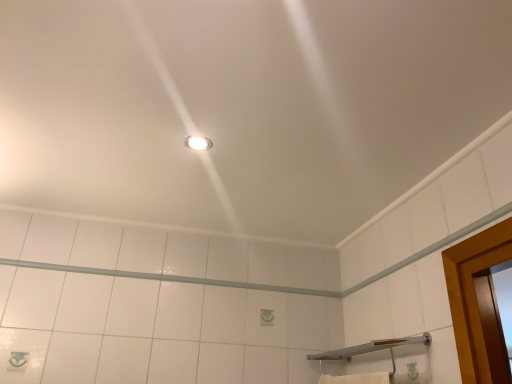
Where is `matte white light fixture at center`? This screenshot has height=384, width=512. matte white light fixture at center is located at coordinates (198, 143).

What do you see at coordinates (198, 143) in the screenshot? The image size is (512, 384). I see `matte white light fixture at center` at bounding box center [198, 143].

What is the approximate width of matte white light fixture at center?

matte white light fixture at center is 3.79 inches wide.

You are a GUI agent. You are given a task and a screenshot of the screen. Output one action in this format:
    pyautogui.click(x=<x>, y=<y>)
    Task: Click on the silver metallic shower at lower right
    The height and width of the screenshot is (384, 512).
    Given the screenshot: What is the action you would take?
    pyautogui.click(x=371, y=347)

Describe the element at coordinates (371, 347) in the screenshot. I see `silver metallic shower at lower right` at that location.

Where is `matte white light fixture at center`? The width and height of the screenshot is (512, 384). matte white light fixture at center is located at coordinates (198, 143).

Is silver metallic shower at lower right to the left of matte white light fixture at center from the viewer's perspective?

No, silver metallic shower at lower right is not to the left of matte white light fixture at center.

Is silver metallic shower at lower right in front of matte white light fixture at center?

Yes, silver metallic shower at lower right is in front of matte white light fixture at center.

Is point (341, 349) farther from viewer compared to point (202, 144)?

Yes.

From the image's perspective, relative to matte white light fixture at center, is silver metallic shower at lower right above or below?

From the image's perspective, silver metallic shower at lower right appears below matte white light fixture at center.

From a real-world perspective, which is physically above, silver metallic shower at lower right or matte white light fixture at center?

matte white light fixture at center, from a real-world perspective.

Which object is thinner, silver metallic shower at lower right or matte white light fixture at center?

matte white light fixture at center is thinner.

Between silver metallic shower at lower right and matte white light fixture at center, which one has less height?

matte white light fixture at center.

Considering the sizes of silver metallic shower at lower right and matte white light fixture at center in the image, is silver metallic shower at lower right bigger or smaller than matte white light fixture at center?

Considering their sizes, silver metallic shower at lower right takes up more space than matte white light fixture at center.

Is silver metallic shower at lower right located outside matte white light fixture at center?

Absolutely, silver metallic shower at lower right is external to matte white light fixture at center.

Does silver metallic shower at lower right touch matte white light fixture at center?

silver metallic shower at lower right and matte white light fixture at center are not in contact.

Is silver metallic shower at lower right facing towards matte white light fixture at center?

No, silver metallic shower at lower right is not facing towards matte white light fixture at center.

Consider the image. How much distance is there between silver metallic shower at lower right and matte white light fixture at center?

38.70 inches.

Find the location of `shower that is below the matte white light fixture at center (from the image's perspective)`. shower that is below the matte white light fixture at center (from the image's perspective) is located at coordinates (371, 347).

Which is more to the right, matte white light fixture at center or silver metallic shower at lower right?

From the viewer's perspective, silver metallic shower at lower right appears more on the right side.

Which object is more forward, matte white light fixture at center or silver metallic shower at lower right?

silver metallic shower at lower right is more forward.

Which is closer to the camera, (195,149) or (415,338)?

Point (195,149) is closer to the camera than point (415,338).

From the image's perspective, which one is positioned higher, matte white light fixture at center or silver metallic shower at lower right?

matte white light fixture at center, from the image's perspective.

From a real-world perspective, is matte white light fixture at center positioned under silver metallic shower at lower right based on gravity?

Incorrect, from a real-world perspective, matte white light fixture at center is higher than silver metallic shower at lower right.

Which of these two, matte white light fixture at center or silver metallic shower at lower right, is wider?

silver metallic shower at lower right.

From their relative heights in the image, would you say matte white light fixture at center is taller or shorter than silver metallic shower at lower right?

In the image, matte white light fixture at center appears to be shorter than silver metallic shower at lower right.

Considering the sizes of objects matte white light fixture at center and silver metallic shower at lower right in the image provided, who is bigger, matte white light fixture at center or silver metallic shower at lower right?

With larger size is silver metallic shower at lower right.

Would you say matte white light fixture at center is outside silver metallic shower at lower right?

matte white light fixture at center lies outside silver metallic shower at lower right's area.

Is matte white light fixture at center beside silver metallic shower at lower right?

matte white light fixture at center and silver metallic shower at lower right are not in contact.

Consider the image. Does matte white light fixture at center turn towards silver metallic shower at lower right?

No, matte white light fixture at center does not turn towards silver metallic shower at lower right.

How different are the orientations of matte white light fixture at center and silver metallic shower at lower right in degrees?

The angle between the facing direction of matte white light fixture at center and the facing direction of silver metallic shower at lower right is 93.4 degrees.

Where is `light fixture lying on the left of silver metallic shower at lower right`? This screenshot has height=384, width=512. light fixture lying on the left of silver metallic shower at lower right is located at coordinates (198, 143).

Locate an element on the screen. light fixture that appears behind the silver metallic shower at lower right is located at coordinates (198, 143).

The image size is (512, 384). What are the coordinates of `shower below the matte white light fixture at center (from the image's perspective)` in the screenshot? It's located at (371, 347).